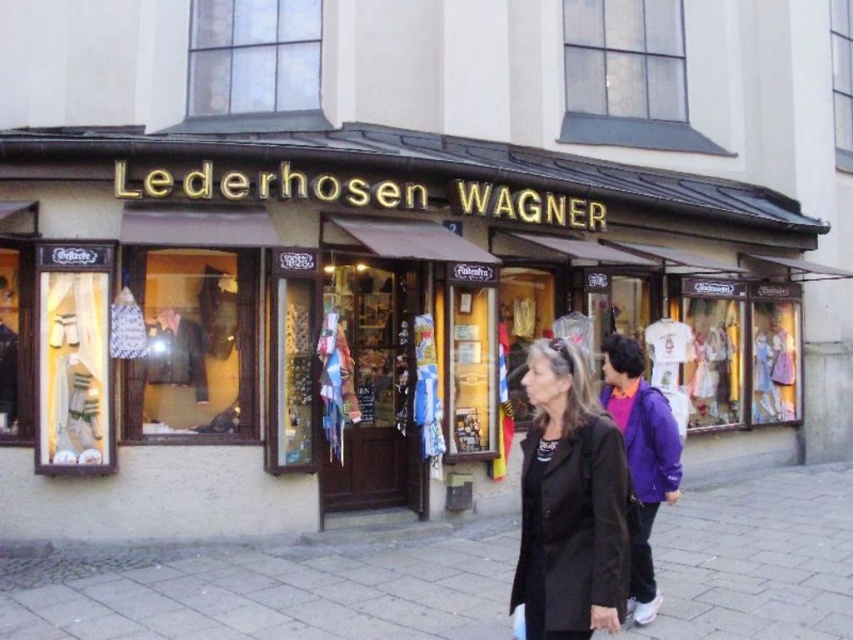
Question: Which object appears farthest from the camera in this image?

Choices:
 (A) purple fleece jacket at center
 (B) gray stone pavement at lower center

Answer: (B)

Question: Which object is positioned closest to the matte black sign at center?

Choices:
 (A) black leather jacket at lower right
 (B) gray stone pavement at lower center
 (C) purple fleece jacket at center

Answer: (B)

Question: Can you confirm if matte black sign at center is bigger than gray stone pavement at lower center?

Choices:
 (A) yes
 (B) no

Answer: (A)

Question: Which of the following is the farthest from the observer?

Choices:
 (A) gray stone pavement at lower center
 (B) black leather jacket at lower right
 (C) matte black sign at center

Answer: (C)

Question: Considering the relative positions of black leather jacket at lower right and purple fleece jacket at center in the image provided, where is black leather jacket at lower right located with respect to purple fleece jacket at center?

Choices:
 (A) right
 (B) left

Answer: (B)

Question: Where is matte black sign at center located in relation to purple fleece jacket at center in the image?

Choices:
 (A) right
 (B) left

Answer: (A)